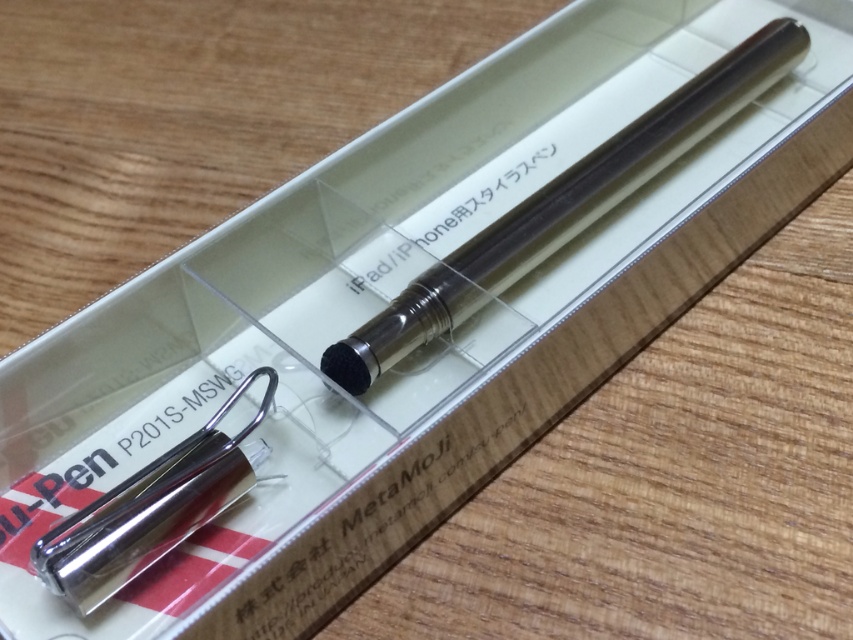
Question: Does satin silver pen at center appear over polished silver pen at lower left?

Choices:
 (A) no
 (B) yes

Answer: (B)

Question: Is satin silver pen at center behind polished silver pen at lower left?

Choices:
 (A) yes
 (B) no

Answer: (A)

Question: Among these points, which one is farthest from the camera?

Choices:
 (A) (631, 140)
 (B) (85, 522)

Answer: (A)

Question: Which point appears farthest from the camera in this image?

Choices:
 (A) (236, 474)
 (B) (699, 74)

Answer: (B)

Question: Can you confirm if satin silver pen at center is thinner than polished silver pen at lower left?

Choices:
 (A) yes
 (B) no

Answer: (B)